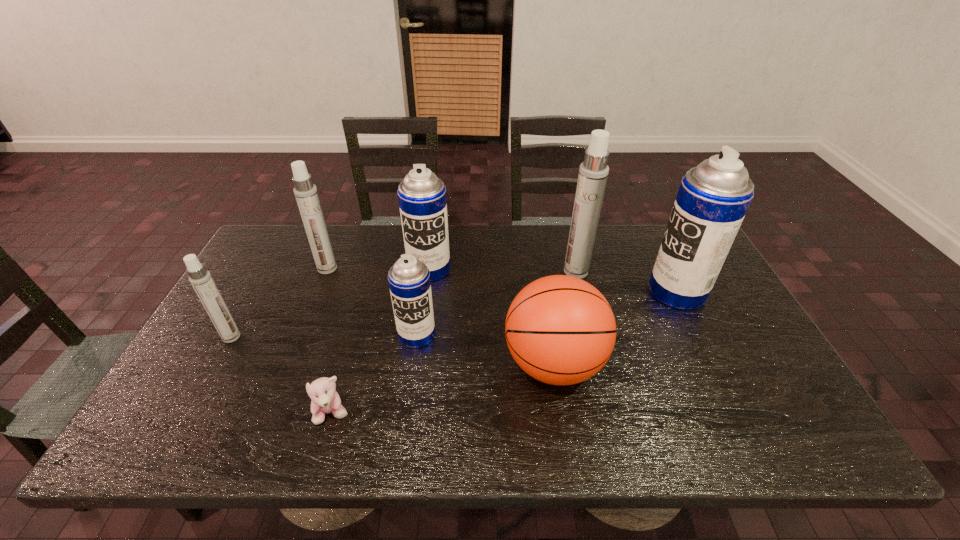
This screenshot has width=960, height=540. Identify the location of the rightmost white aerosol can. (593, 172).

In order to click on the biggest white aerosol can in this screenshot , I will do `click(593, 172)`.

I want to click on the rightmost blue aerosol can, so click(713, 198).

Where is `the rightmost object`? the rightmost object is located at coordinates (713, 198).

This screenshot has width=960, height=540. What are the coordinates of `the second aerosol can from left to right` in the screenshot? It's located at (306, 194).

You are a GUI agent. You are given a task and a screenshot of the screen. Output one action in this format:
    pyautogui.click(x=<x>, y=<y>)
    Task: Click on the seventh object from right to left
    The width and height of the screenshot is (960, 540).
    Given the screenshot: What is the action you would take?
    pyautogui.click(x=306, y=194)

Locate an element on the screen. the second smallest blue aerosol can is located at coordinates (422, 199).

Find the location of `the leftmost object`. the leftmost object is located at coordinates (200, 278).

Locate an element on the screen. The height and width of the screenshot is (540, 960). the smallest white aerosol can is located at coordinates (200, 278).

Image resolution: width=960 pixels, height=540 pixels. In order to click on the smallest blue aerosol can in this screenshot , I will do `click(409, 278)`.